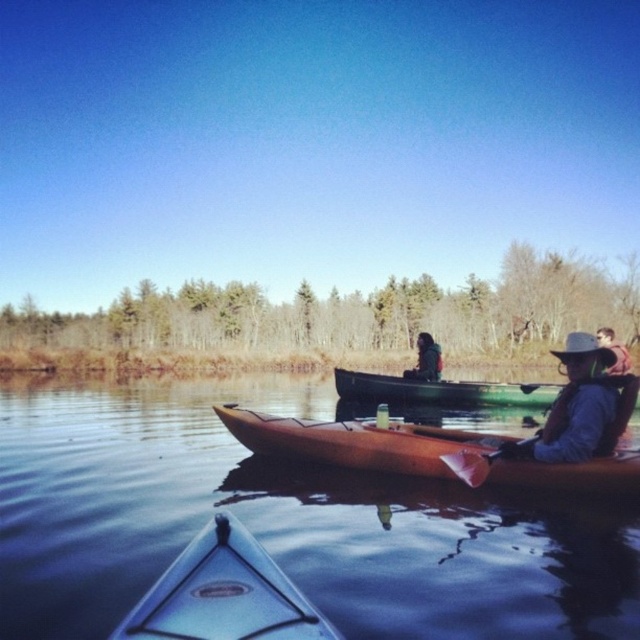
Consider the image. You are in a kayak and see the brown matte water at center and the pink foam paddle at center. Which object is closer to you?

The brown matte water at center is closer to you because it is in front of the pink foam paddle at center.

You are a photographer standing on a dock and want to capture a close shot of the brown matte water at center. Your camera can focus on objects up to 10 feet away. Can you take the photo without moving closer?

The brown matte water at center is 12.50 feet away, which is beyond the camera focus range of 10 feet. Therefore, you cannot take the photo without moving closer.

You are in a kayak and see the brown matte water at center and the dark brown leather jacket at center. Which object is closer to you?

The brown matte water at center is closer to you as it is in front of the dark brown leather jacket at center.